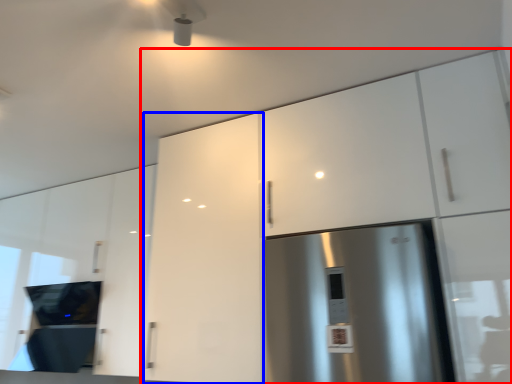
Question: Which point is closer to the camera, cabinetry (highlighted by a red box) or cabinetry (highlighted by a blue box)?

Choices:
 (A) cabinetry
 (B) cabinetry

Answer: (A)